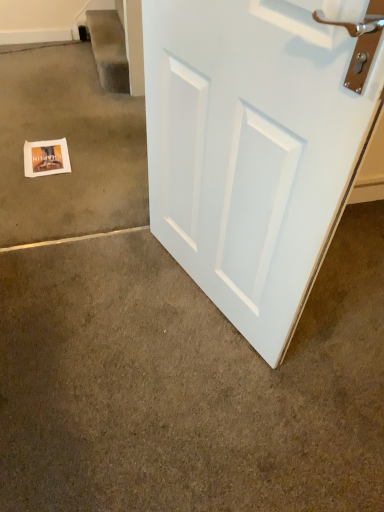
Question: Choose the correct answer: Is white matte door at center, arranged as the second concrete when viewed from the top, inside white paper at lower left, the 1th concrete when ordered from top to bottom, or outside it?

Choices:
 (A) inside
 (B) outside

Answer: (B)

Question: In the image, is white matte door at center, which ranks as the first concrete in bottom-to-top order, on the left side or the right side of white paper at lower left, placed as the second concrete when sorted from bottom to top?

Choices:
 (A) left
 (B) right

Answer: (B)

Question: Which object is the closest to the white matte door at center, arranged as the second concrete when viewed from the top?

Choices:
 (A) matte paper postcard at lower left
 (B) white paper at lower left, which appears as the 2th concrete when viewed from the front
 (C) carpeted stairwell at upper left
 (D) white matte door at right

Answer: (D)

Question: Based on their relative distances, which object is nearer to the matte paper postcard at lower left?

Choices:
 (A) white matte door at center, arranged as the second concrete when viewed from the top
 (B) white paper at lower left, the 1th concrete when ordered from top to bottom
 (C) carpeted stairwell at upper left
 (D) white matte door at right

Answer: (B)